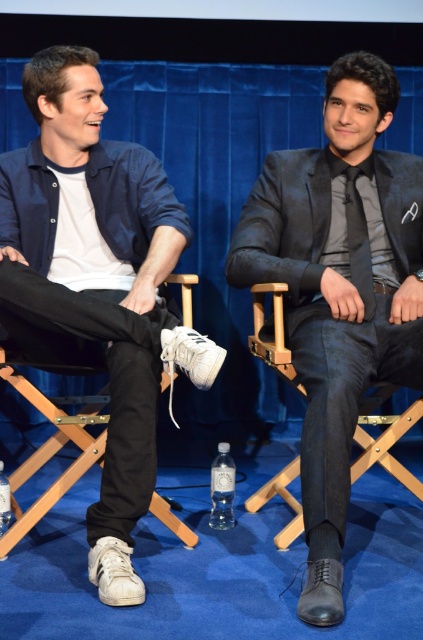
Is white leather sneakers at lower left positioned behind black silk tie at center?

That is False.

Which is in front, point (76, 156) or point (354, 189)?

Point (76, 156) is more forward.

This screenshot has width=423, height=640. I want to click on white leather sneakers at lower left, so click(x=96, y=284).

The height and width of the screenshot is (640, 423). I want to click on white leather sneakers at lower left, so click(96, 284).

Does shiny black suit at center come behind black silk tie at center?

That is False.

Is shiny black suit at center wider than black silk tie at center?

Yes, shiny black suit at center is wider than black silk tie at center.

Where is `shiny black suit at center`? shiny black suit at center is located at coordinates [x=288, y=236].

Which is below, shiny black suit at center or white fabric folding chair at left?

white fabric folding chair at left

What do you see at coordinates (288, 236) in the screenshot?
I see `shiny black suit at center` at bounding box center [288, 236].

Locate an element on the screen. shiny black suit at center is located at coordinates (288, 236).